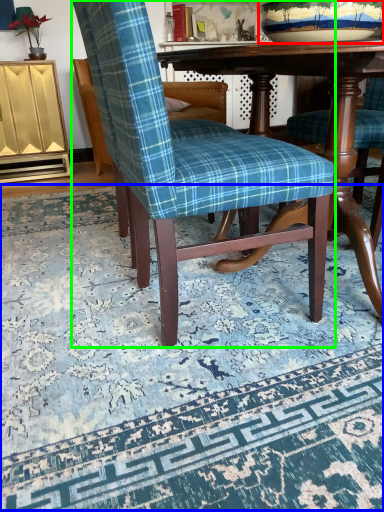
Question: Considering the real-world distances, which object is farthest from bowl (highlighted by a red box)? mat (highlighted by a blue box) or chair (highlighted by a green box)?

Choices:
 (A) mat
 (B) chair

Answer: (A)